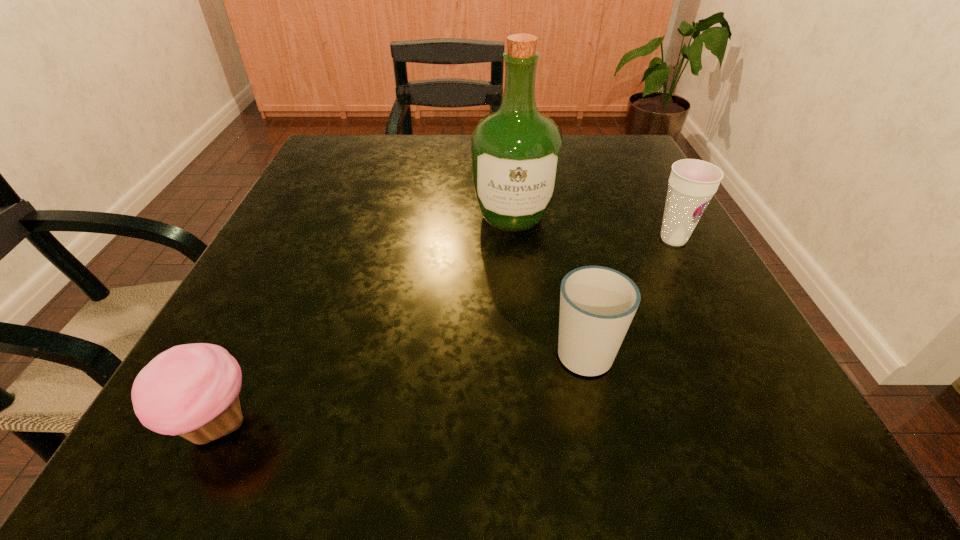
Identify the location of liquor. (516, 151).

Identify the location of the farther cup. The image size is (960, 540). tap(692, 183).

At what (x,y) coordinates should I click in order to perform the action: click on the right cup. Please return your answer as a coordinate pair (x, y). The width and height of the screenshot is (960, 540). Looking at the image, I should click on (692, 183).

Where is `the nearer cup`? Image resolution: width=960 pixels, height=540 pixels. the nearer cup is located at coordinates (597, 304).

I want to click on the left cup, so click(597, 304).

Where is `the nearest object`? The width and height of the screenshot is (960, 540). the nearest object is located at coordinates (192, 390).

You are a GUI agent. You are given a task and a screenshot of the screen. Output one action in this format:
    pyautogui.click(x=<x>, y=<y>)
    Task: Click on the cupcake
    The height and width of the screenshot is (540, 960).
    Given the screenshot: What is the action you would take?
    pyautogui.click(x=192, y=390)

Where is `free space located 0.350m on the front-facing side of the liquor`? free space located 0.350m on the front-facing side of the liquor is located at coordinates (532, 424).

Find the location of a particular element. vacant space situated 0.190m on the back of the right cup is located at coordinates click(x=638, y=175).

Where is `vacant space located with a handle on the side of the left cup`? vacant space located with a handle on the side of the left cup is located at coordinates (553, 212).